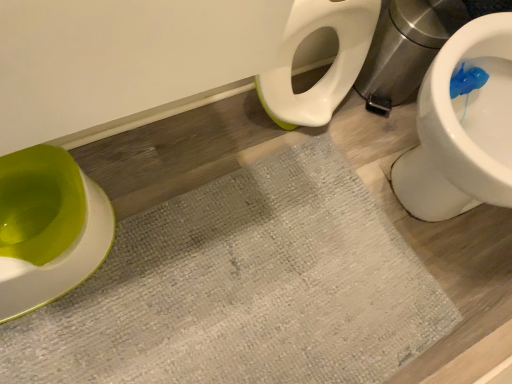
The image size is (512, 384). Describe the element at coordinates (243, 289) in the screenshot. I see `textured gray bath mat at center` at that location.

Where is `textured gray bath mat at center`? textured gray bath mat at center is located at coordinates (243, 289).

The width and height of the screenshot is (512, 384). I want to click on green plastic toilet at left, so click(x=48, y=228).

What is the approximate height of green plastic toilet at left?

The height of green plastic toilet at left is 25.55 centimeters.

The width and height of the screenshot is (512, 384). What do you see at coordinates (48, 228) in the screenshot?
I see `green plastic toilet at left` at bounding box center [48, 228].

Image resolution: width=512 pixels, height=384 pixels. I want to click on textured gray bath mat at center, so click(x=243, y=289).

Which object is positioned more to the left, green plastic toilet at left or textured gray bath mat at center?

From the viewer's perspective, green plastic toilet at left appears more on the left side.

Is green plastic toilet at left in front of or behind textured gray bath mat at center in the image?

green plastic toilet at left is positioned closer to the viewer than textured gray bath mat at center.

Is point (32, 254) more distant than point (236, 178)?

No, (32, 254) is in front of (236, 178).

From the image's perspective, which one is positioned lower, green plastic toilet at left or textured gray bath mat at center?

textured gray bath mat at center.

From a real-world perspective, is green plastic toilet at left positioned under textured gray bath mat at center based on gravity?

Incorrect, from a real-world perspective, green plastic toilet at left is higher than textured gray bath mat at center.

Can you confirm if green plastic toilet at left is wider than textured gray bath mat at center?

No.

Can you confirm if green plastic toilet at left is shorter than textured gray bath mat at center?

Incorrect, the height of green plastic toilet at left does not fall short of that of textured gray bath mat at center.

Considering the sizes of objects green plastic toilet at left and textured gray bath mat at center in the image provided, who is smaller, green plastic toilet at left or textured gray bath mat at center?

Smaller between the two is green plastic toilet at left.

Is textured gray bath mat at center inside green plastic toilet at left?

No.

Are green plastic toilet at left and textured gray bath mat at center located far from each other?

They are positioned close to each other.

Is green plastic toilet at left oriented towards textured gray bath mat at center?

No, green plastic toilet at left is not turned towards textured gray bath mat at center.

From the picture: Can you tell me how much green plastic toilet at left and textured gray bath mat at center differ in facing direction?

They differ by 90 degrees in their facing directions.

Locate an element on the screen. The height and width of the screenshot is (384, 512). bath mat that appears behind the green plastic toilet at left is located at coordinates (243, 289).

Considering the positions of objects textured gray bath mat at center and green plastic toilet at left in the image provided, who is more to the right, textured gray bath mat at center or green plastic toilet at left?

From the viewer's perspective, textured gray bath mat at center appears more on the right side.

Is the depth of textured gray bath mat at center greater than that of green plastic toilet at left?

Yes, it is.

Between point (296, 188) and point (16, 314), which one is positioned in front?

Point (16, 314)

From the image's perspective, between textured gray bath mat at center and green plastic toilet at left, who is located below?

textured gray bath mat at center.

Looking at this image, from a real-world perspective, is textured gray bath mat at center over green plastic toilet at left?

No, from a real-world perspective, textured gray bath mat at center is not on top of green plastic toilet at left.

Which of these two, textured gray bath mat at center or green plastic toilet at left, is wider?

Wider between the two is textured gray bath mat at center.

Is textured gray bath mat at center taller than green plastic toilet at left?

In fact, textured gray bath mat at center may be shorter than green plastic toilet at left.

Is textured gray bath mat at center bigger or smaller than green plastic toilet at left?

Considering their sizes, textured gray bath mat at center takes up more space than green plastic toilet at left.

Is textured gray bath mat at center not inside green plastic toilet at left?

Yes, textured gray bath mat at center is outside of green plastic toilet at left.

Does textured gray bath mat at center touch green plastic toilet at left?

No, textured gray bath mat at center is not touching green plastic toilet at left.

Does textured gray bath mat at center turn towards green plastic toilet at left?

No, textured gray bath mat at center is not oriented towards green plastic toilet at left.

At what (x,y) coordinates should I click in order to perform the action: click on bath mat below the green plastic toilet at left (from a real-world perspective). Please return your answer as a coordinate pair (x, y). Looking at the image, I should click on (243, 289).

Where is `toilet above the textured gray bath mat at center (from the image's perspective)`? Image resolution: width=512 pixels, height=384 pixels. toilet above the textured gray bath mat at center (from the image's perspective) is located at coordinates (48, 228).

Identify the location of bath mat behind the green plastic toilet at left. The width and height of the screenshot is (512, 384). (243, 289).